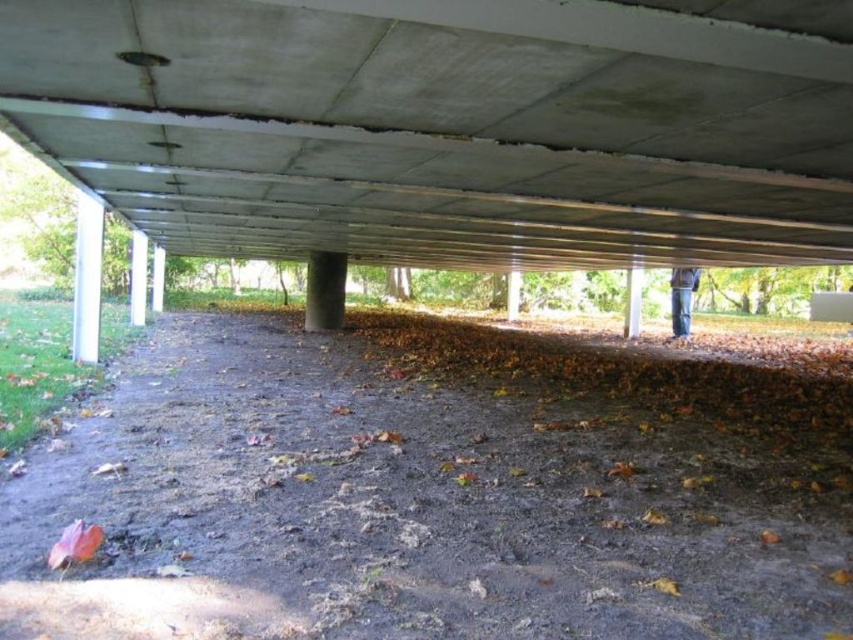
Locate an element on the screen. This screenshot has width=853, height=640. concrete ceiling at center is located at coordinates (448, 125).

Does concrete ceiling at center come behind dirt ground at center?

Yes, concrete ceiling at center is behind dirt ground at center.

Who is more forward, (602, 10) or (111, 392)?

Point (602, 10) is in front.

Where is `concrete ceiling at center`? The width and height of the screenshot is (853, 640). concrete ceiling at center is located at coordinates (448, 125).